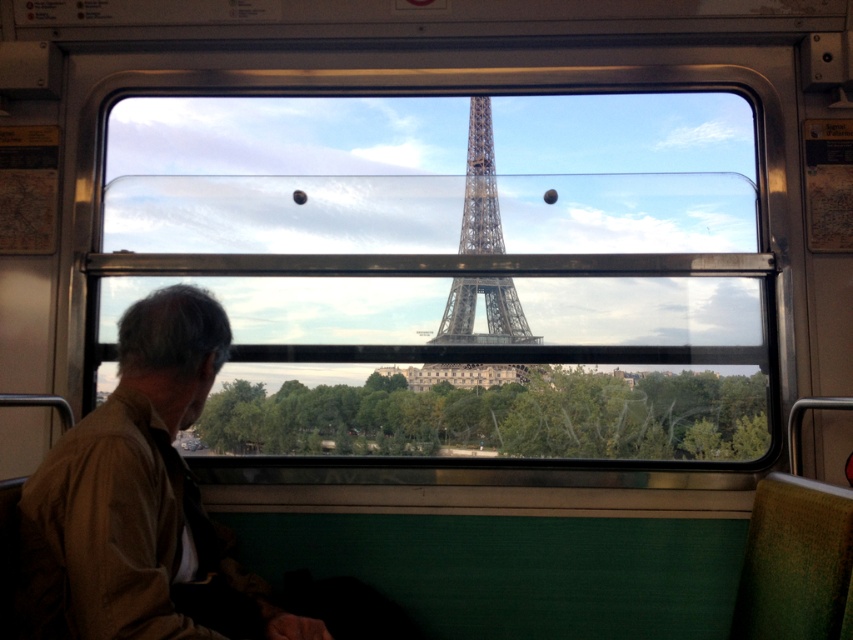
Consider the image. You are a passenger on the train and see the brown cotton shirt at left and the metallic gray eiffel tower at center through the window. Which object is closer to the left side of your view?

The brown cotton shirt at left is closer to the left side of your view because it is positioned to the left of the metallic gray eiffel tower at center.

You are sitting in a train seat and want to know how far you are from the point where the window frame meets the top edge of the Eiffel Tower in the scene. The point is marked as point (73, 468) in the image. Can you determine the distance?

The point (73, 468) is 6.49 meters away from the viewer, so you are 6.49 meters away from that point.

You are sitting in the train and want to know what is at the point marked as point (x=134, y=493). What object is located there?

The point (x=134, y=493) marks the brown cotton shirt at left.